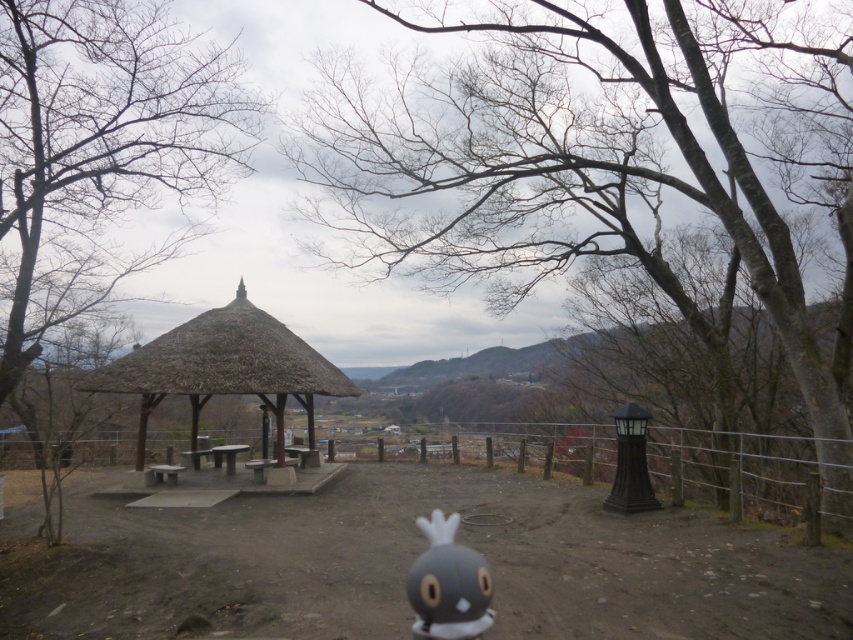
Is bare wood tree at center wider than thatched wood gazebo at center?

Correct, the width of bare wood tree at center exceeds that of thatched wood gazebo at center.

Which is behind, point (839, 522) or point (202, 372)?

Positioned behind is point (202, 372).

What do you see at coordinates (585, 166) in the screenshot? Image resolution: width=853 pixels, height=640 pixels. I see `bare wood tree at center` at bounding box center [585, 166].

Find the location of `bare wood tree at center`. bare wood tree at center is located at coordinates (585, 166).

Does point (399, 579) come in front of point (425, 616)?

That is False.

Between dull brown dirt at center and gray matte plush toy at center, which one appears on the right side from the viewer's perspective?

Positioned to the right is gray matte plush toy at center.

Which is in front, point (416, 476) or point (448, 632)?

Positioned in front is point (448, 632).

Identify the location of dull brown dirt at center. (409, 563).

Between point (318, 616) and point (206, 316), which one is positioned in front?

Point (318, 616) is in front.

Is the position of dull brown dirt at center more distant than that of thatched wood gazebo at center?

No, dull brown dirt at center is closer to the viewer.

Locate an element on the screen. This screenshot has width=853, height=640. dull brown dirt at center is located at coordinates (409, 563).